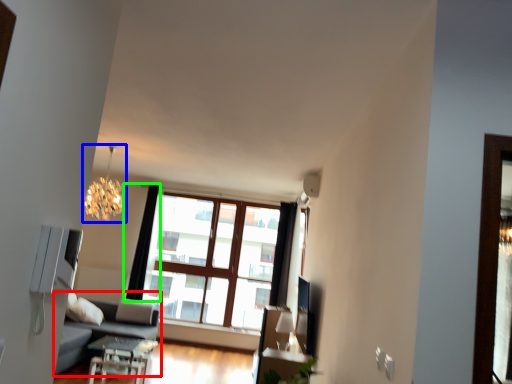
Question: Which object is positioned farthest from studio couch (highlighted by a red box)? Select from lamp (highlighted by a blue box) and curtain (highlighted by a green box).

Choices:
 (A) lamp
 (B) curtain

Answer: (A)